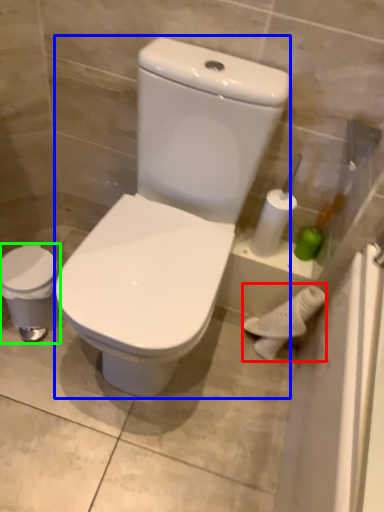
Question: Which is nearer to the porcelain (highlighted by a red box)? porcelain (highlighted by a blue box) or porcelain (highlighted by a green box).

Choices:
 (A) porcelain
 (B) porcelain

Answer: (A)